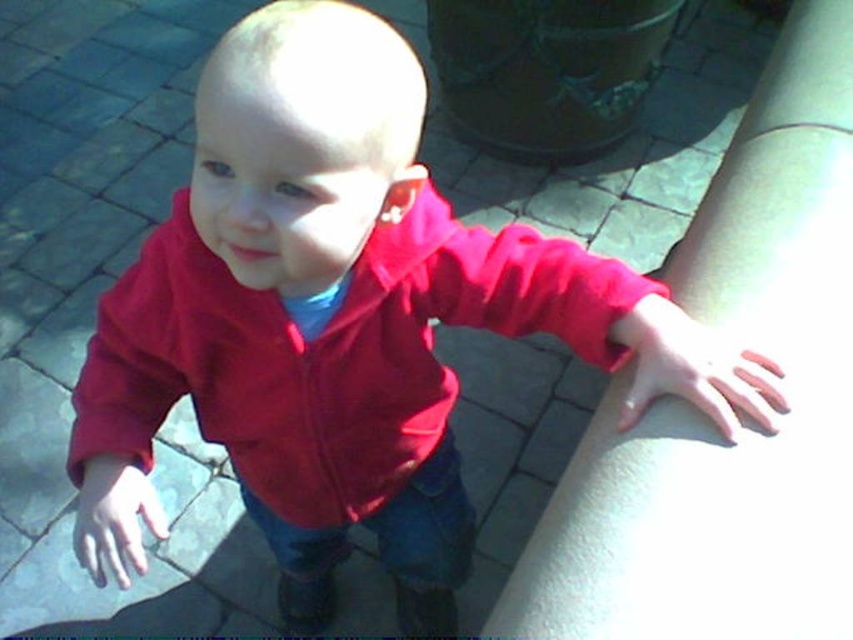
You are a fashion designer observing the child in the scene. You need to determine which item of clothing is bigger between the matte red jacket at center and the pink fabric at lower right. Which one is larger?

The matte red jacket at center is larger in size than the pink fabric at lower right.

You are a painter observing the scene and want to paint both the smooth skin hand at lower right and the matte red hand at lower left. Which hand should you paint larger to accurately represent their sizes in the image?

The smooth skin hand at lower right is larger in size than the matte red hand at lower left, so you should paint the smooth skin hand at lower right larger than the matte red hand at lower left.

You are a photographer trying to capture the child in the scene. You notice two points marked in the image. The first point is at coordinates point (x=103, y=429) and the second point is at point (x=660, y=314). Which point is closer to the camera lens?

Point (x=103, y=429) is closer to the camera lens because it is further to the viewer than point (x=660, y=314).